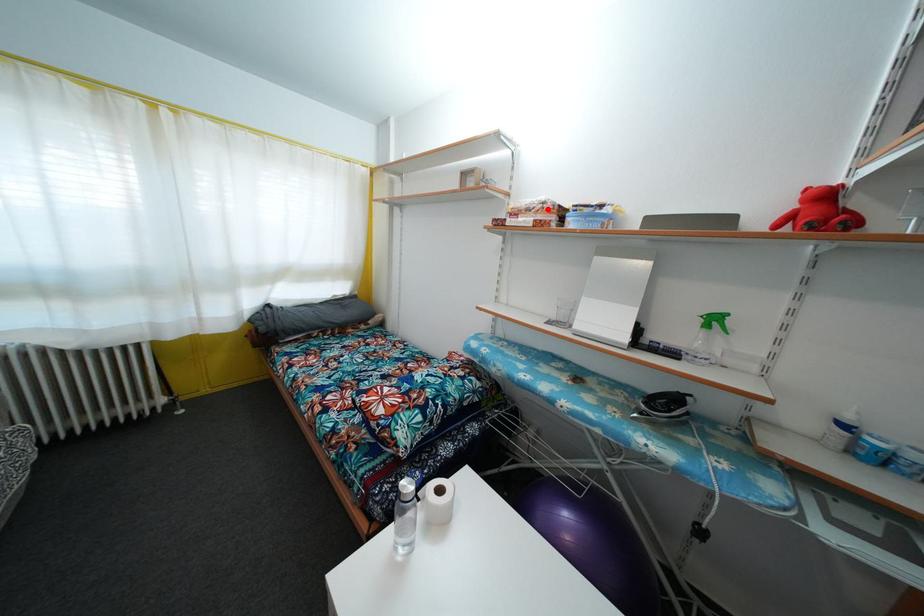
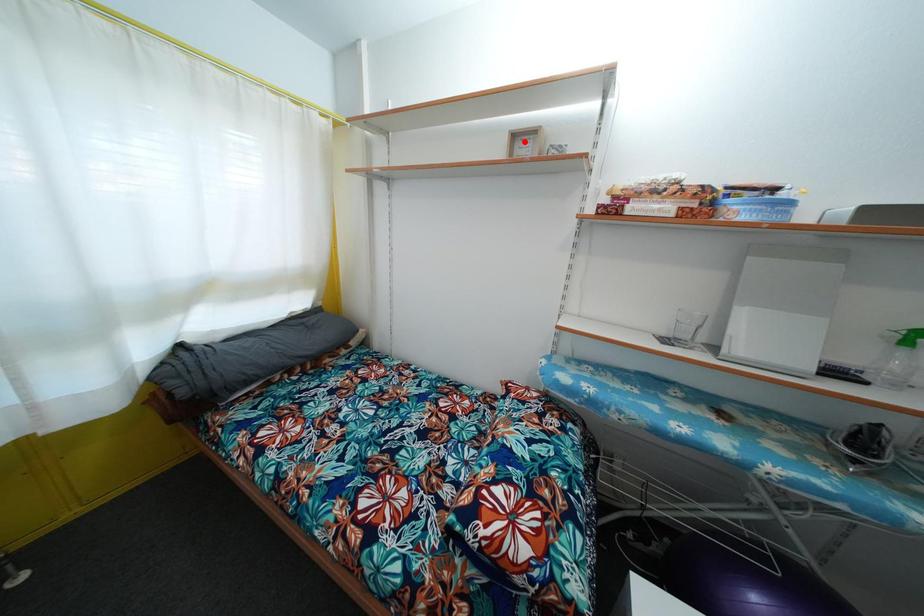
I am providing you with two images of the same scene from different viewpoints. A red point is marked on the first image and another point is marked on the second image. Are the points marked in image1 and image2 representing the same 3D position?

No